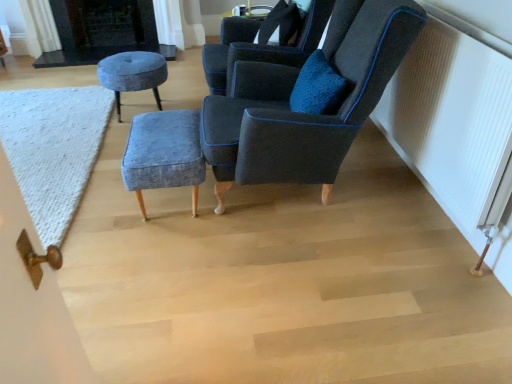
Where is `vacant space situated on the left part of denim fabric stool at center, the 1th stool in the right-to-left sequence`? The height and width of the screenshot is (384, 512). vacant space situated on the left part of denim fabric stool at center, the 1th stool in the right-to-left sequence is located at coordinates (109, 208).